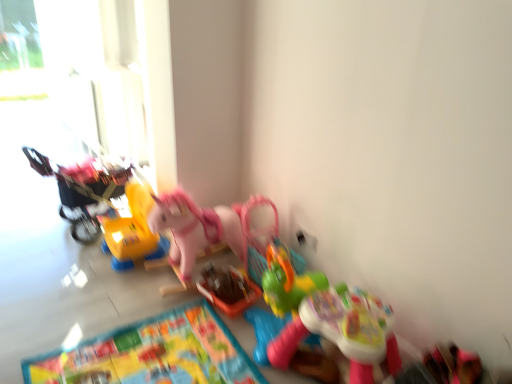
Question: In the image, is pink plastic rocking horse at center, the third toy in the right-to-left sequence, positioned in front of or behind multicolored fabric mat at lower center?

Choices:
 (A) behind
 (B) front

Answer: (A)

Question: Considering the positions of pink plastic rocking horse at center, the 4th toy in the left-to-right sequence, and multicolored fabric mat at lower center in the image, is pink plastic rocking horse at center, the 4th toy in the left-to-right sequence, wider or thinner than multicolored fabric mat at lower center?

Choices:
 (A) wide
 (B) thin

Answer: (A)

Question: Estimate the real-world distances between objects in this image. Which object is farther from the plastic colorful walker at lower right, the 6th toy in the left-to-right sequence?

Choices:
 (A) multicolored fabric mat at lower center
 (B) pink plastic rocking horse at center, the third toy in the right-to-left sequence
 (C) yellow plastic toy car at left, acting as the 1th toy starting from the left
 (D) yellow plastic toy at center-left, which ranks as the 5th toy in right-to-left order
 (E) pink plastic rocking horse at center, the 3th toy when ordered from left to right

Answer: (C)

Question: Which is nearer to the yellow plastic toy at center-left, which is the 2th toy from left to right?

Choices:
 (A) yellow plastic toy car at left, acting as the 1th toy starting from the left
 (B) pink plastic rocking horse at center, the third toy in the right-to-left sequence
 (C) plastic basket at center, the 2th toy positioned from the right
 (D) plastic colorful walker at lower right, acting as the 1th toy starting from the right
 (E) pink plastic rocking horse at center, the 3th toy when ordered from left to right

Answer: (A)